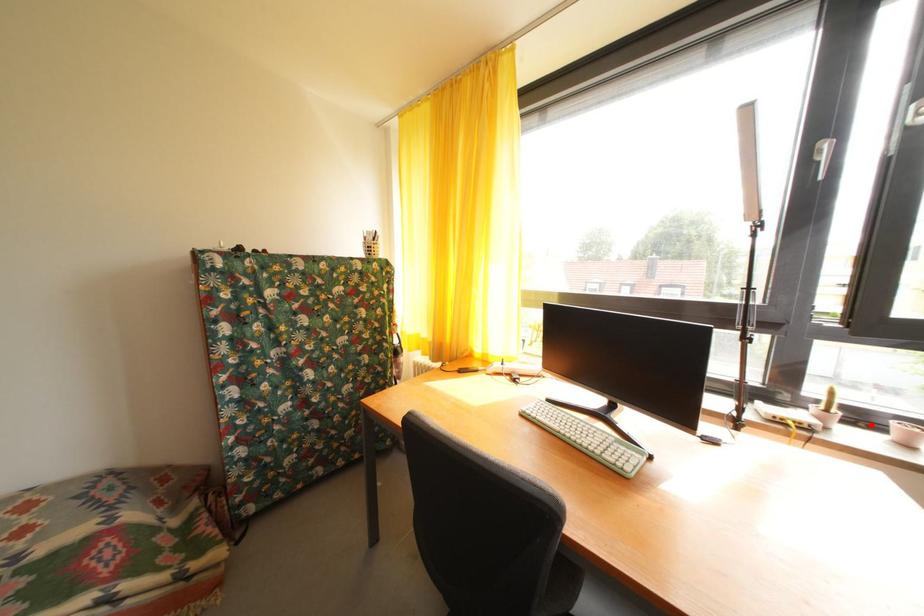
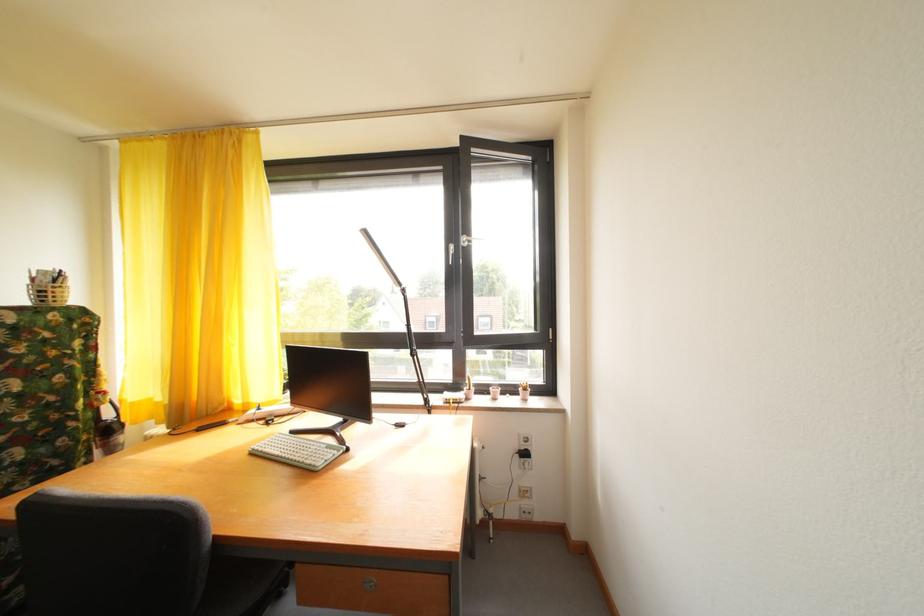
Locate, in the second image, the point that corresponds to the highlighted location in the first image.

(492, 395)